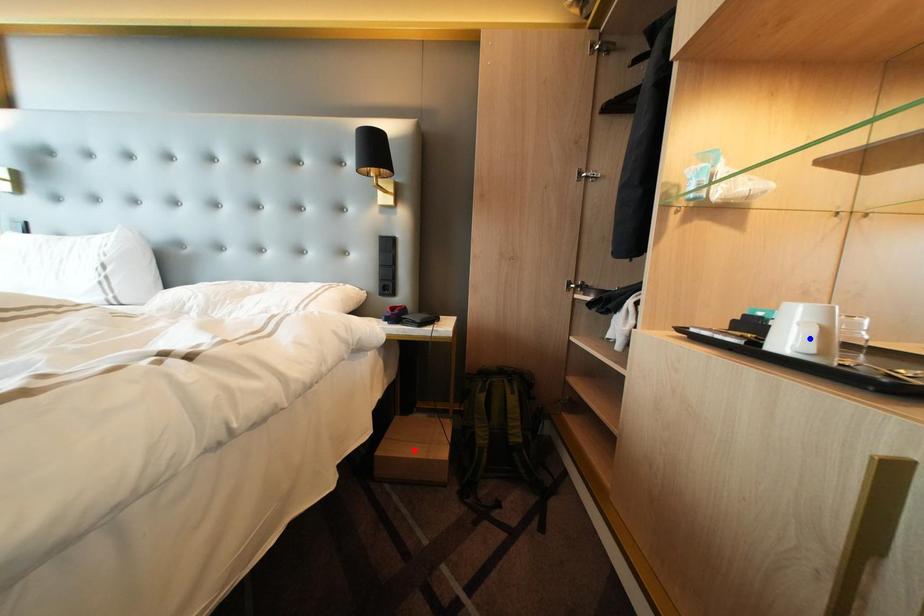
Question: Two points are marked on the image. Which point is closer to the camera?

Choices:
 (A) Blue point is closer.
 (B) Red point is closer.

Answer: (A)